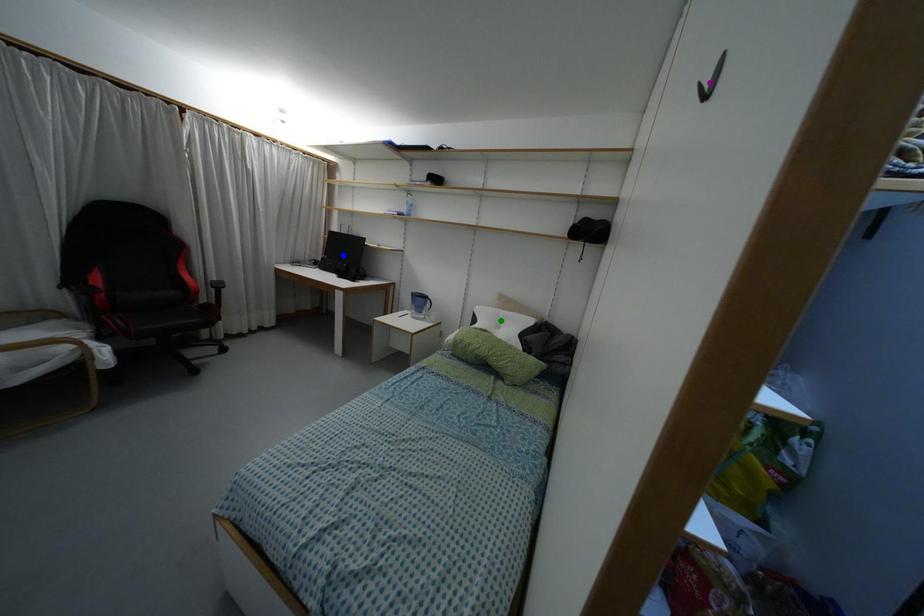
Order these from nearest to farthest:
green point
blue point
purple point

1. purple point
2. green point
3. blue point